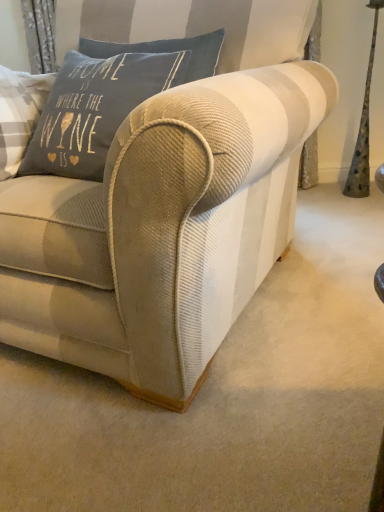
Question: Considering the positions of beige corduroy couch at center and matte gray cushion at upper left in the image, is beige corduroy couch at center wider or thinner than matte gray cushion at upper left?

Choices:
 (A) thin
 (B) wide

Answer: (B)

Question: Is beige corduroy couch at center to the left or to the right of matte gray cushion at upper left in the image?

Choices:
 (A) right
 (B) left

Answer: (A)

Question: Relative to matte gray cushion at upper left, is beige corduroy couch at center in front or behind?

Choices:
 (A) front
 (B) behind

Answer: (A)

Question: From a real-world perspective, is matte gray cushion at upper left positioned above or below beige corduroy couch at center?

Choices:
 (A) above
 (B) below

Answer: (A)

Question: From the image's perspective, is matte gray cushion at upper left above or below beige corduroy couch at center?

Choices:
 (A) above
 (B) below

Answer: (A)

Question: Considering the relative positions of matte gray cushion at upper left and beige corduroy couch at center in the image provided, is matte gray cushion at upper left to the left or to the right of beige corduroy couch at center?

Choices:
 (A) left
 (B) right

Answer: (A)

Question: Do you think matte gray cushion at upper left is within beige corduroy couch at center, or outside of it?

Choices:
 (A) inside
 (B) outside

Answer: (A)